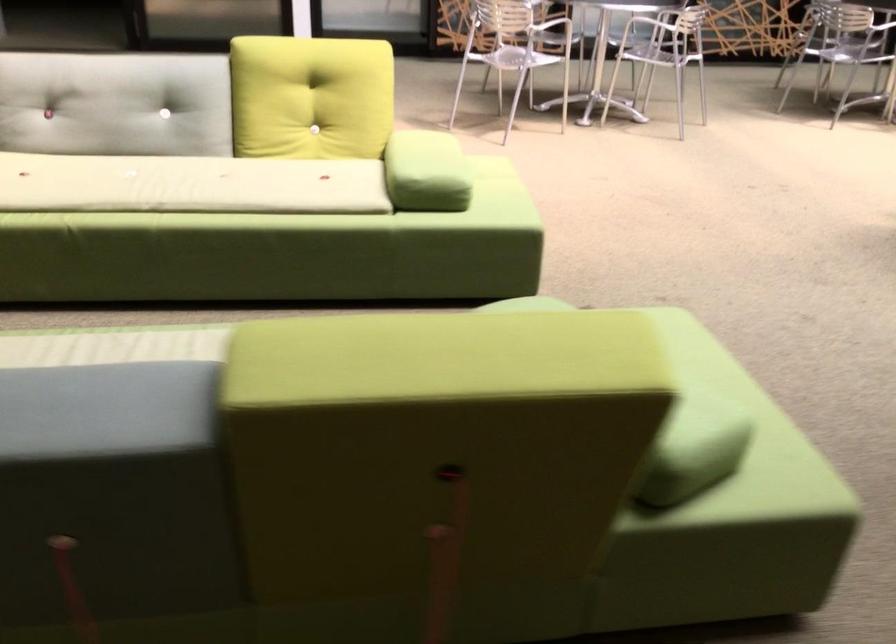
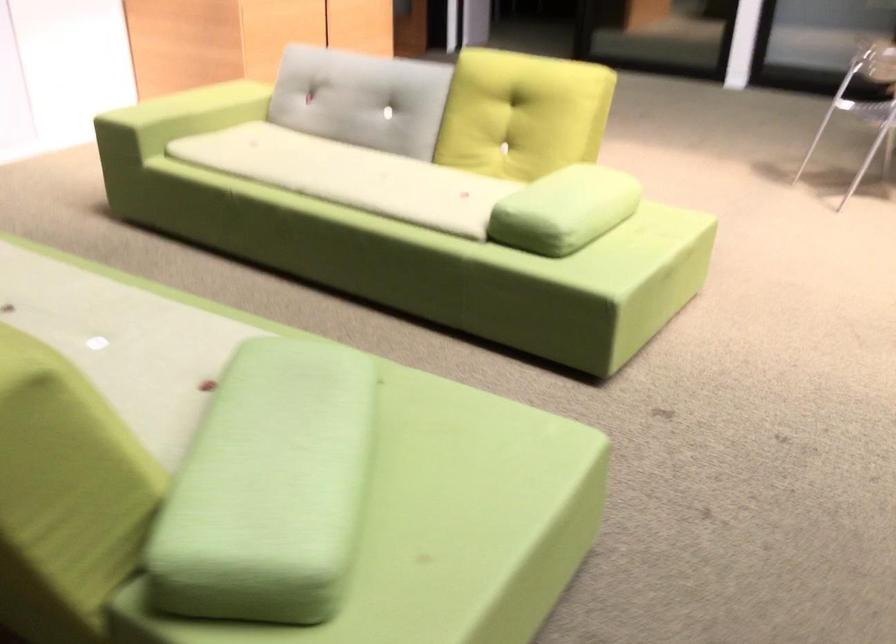
The point at (452, 165) is marked in the first image. Where is the corresponding point in the second image?

(564, 210)